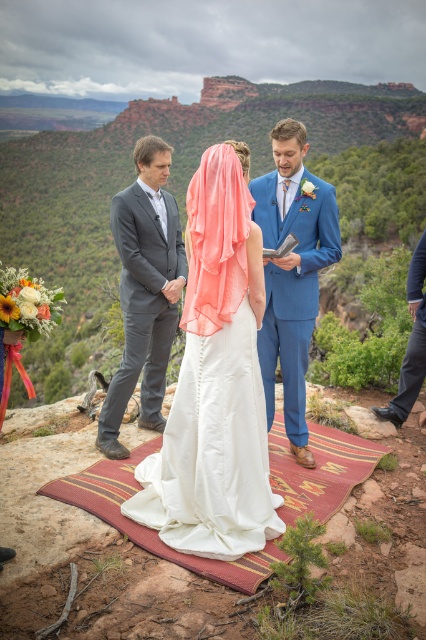
Question: Which point appears closest to the camera in this image?

Choices:
 (A) (135, 236)
 (B) (324, 513)
 (C) (267, 244)

Answer: (B)

Question: Does blue satin suit at center have a greater width compared to dark blue jeans at lower right?

Choices:
 (A) no
 (B) yes

Answer: (A)

Question: Which point is farther to the camera?

Choices:
 (A) (313, 492)
 (B) (118, 401)
 (C) (296, 305)
 (D) (405, 394)

Answer: (D)

Question: Is white satin dress at center wider than matte gray suit at left?

Choices:
 (A) no
 (B) yes

Answer: (B)

Question: Can you confirm if white satin dress at center is thinner than dark blue jeans at lower right?

Choices:
 (A) yes
 (B) no

Answer: (B)

Question: Which object is farther from the camera taking this photo?

Choices:
 (A) blue satin suit at center
 (B) dark blue jeans at lower right
 (C) matte gray suit at left

Answer: (B)